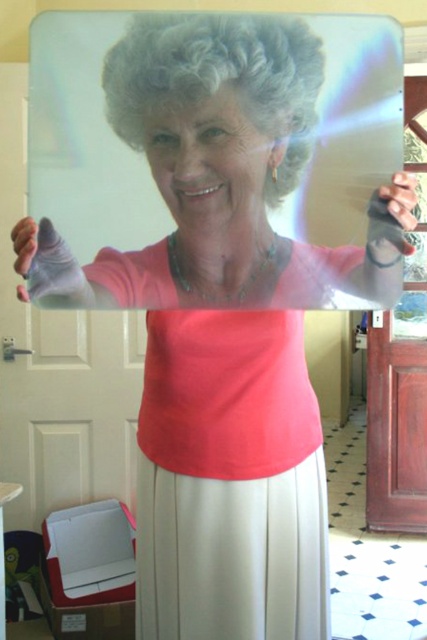
Who is positioned more to the right, matte pink glove at left or matte black glove at upper right?

matte black glove at upper right

Who is shorter, matte pink glove at left or matte black glove at upper right?

With less height is matte black glove at upper right.

The height and width of the screenshot is (640, 427). What are the coordinates of `matte pink glove at left` in the screenshot? It's located at (46, 264).

Does point (303, 64) come behind point (391, 198)?

That is False.

Can you confirm if curly gray wig at upper center is taller than matte black glove at upper right?

Correct, curly gray wig at upper center is much taller as matte black glove at upper right.

Does point (257, 52) come in front of point (397, 184)?

Yes, point (257, 52) is closer to viewer.

The width and height of the screenshot is (427, 640). What are the coordinates of `curly gray wig at upper center` in the screenshot? It's located at (219, 76).

Between curly gray wig at upper center and matte pink glove at left, which one is positioned higher?

curly gray wig at upper center

Which is more to the right, curly gray wig at upper center or matte pink glove at left?

Positioned to the right is curly gray wig at upper center.

What do you see at coordinates (219, 76) in the screenshot? The height and width of the screenshot is (640, 427). I see `curly gray wig at upper center` at bounding box center [219, 76].

This screenshot has width=427, height=640. Find the location of `curly gray wig at upper center`. curly gray wig at upper center is located at coordinates (219, 76).